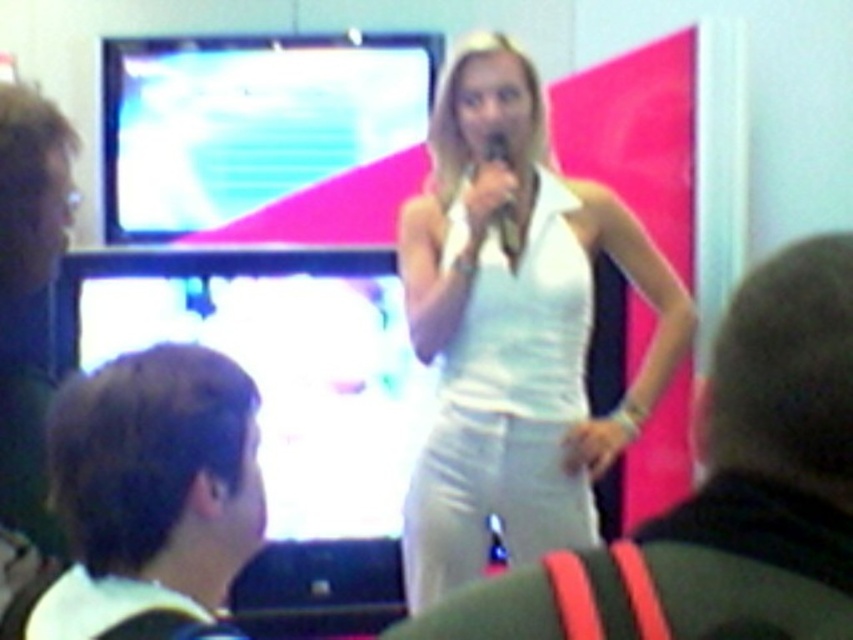
This screenshot has height=640, width=853. Describe the element at coordinates (151, 496) in the screenshot. I see `brown hair at lower left` at that location.

Is brown hair at lower left to the left of matte black microphone at center from the viewer's perspective?

Yes, brown hair at lower left is to the left of matte black microphone at center.

The height and width of the screenshot is (640, 853). In order to click on brown hair at lower left in this screenshot , I will do `click(151, 496)`.

Does white fabric shirt at center appear under brown hair at lower left?

No.

Which is above, white fabric shirt at center or brown hair at lower left?

Positioned higher is white fabric shirt at center.

Does point (848, 499) come closer to viewer compared to point (195, 497)?

Yes, point (848, 499) is in front of point (195, 497).

Identify the location of white fabric shirt at center. The height and width of the screenshot is (640, 853). (721, 493).

Measure the distance between white smooth dress at center and white fabric shirt at center.

They are 6.05 feet apart.

How far apart are white smooth dress at center and white fabric shirt at center?

The distance of white smooth dress at center from white fabric shirt at center is 6.05 feet.

Which is in front, point (496, 97) or point (809, 266)?

Point (809, 266)

Find the location of a particular element. The height and width of the screenshot is (640, 853). white smooth dress at center is located at coordinates (514, 330).